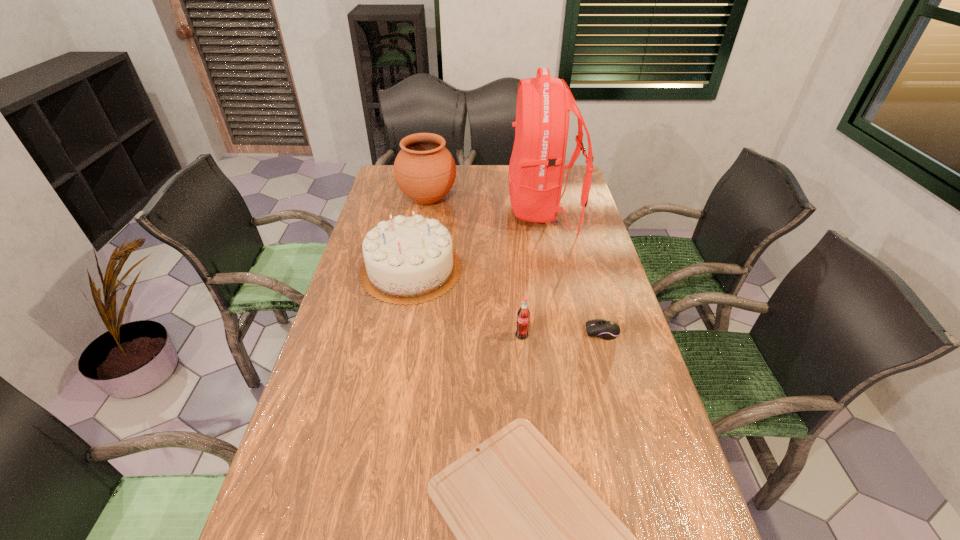
Identify the location of free point at the far edge. coord(481,165).

In the image, there is a desktop. Identify the location of vacant space at the left edge. (321, 374).

You are a GUI agent. You are given a task and a screenshot of the screen. Output one action in this format:
    pyautogui.click(x=<x>, y=<y>)
    Task: Click on the vacant space at the right edge of the desktop
    The height and width of the screenshot is (540, 960).
    Given the screenshot: What is the action you would take?
    pyautogui.click(x=578, y=210)

In the image, there is a desktop. Identify the location of free space at the far left corner. The height and width of the screenshot is (540, 960). (385, 176).

Locate an element on the screen. vacant space at the far right corner of the desktop is located at coordinates (574, 179).

Find the location of a particular element. The image size is (960, 540). vacant area that lies between the computer mouse and the birthday cake is located at coordinates (507, 301).

At what (x,y) coordinates should I click in order to perform the action: click on empty location between the pottery and the computer mouse. Please return your answer as a coordinate pair (x, y). Looking at the image, I should click on (515, 266).

This screenshot has width=960, height=540. Find the location of `vacant space that's between the backpack and the pottery`. vacant space that's between the backpack and the pottery is located at coordinates (486, 205).

Find the location of a particular element. unoccupied area between the fifth tallest object and the birthday cake is located at coordinates (507, 301).

This screenshot has width=960, height=540. Identify the location of vacant space that's between the second shortest object and the fifth shortest object. (515, 266).